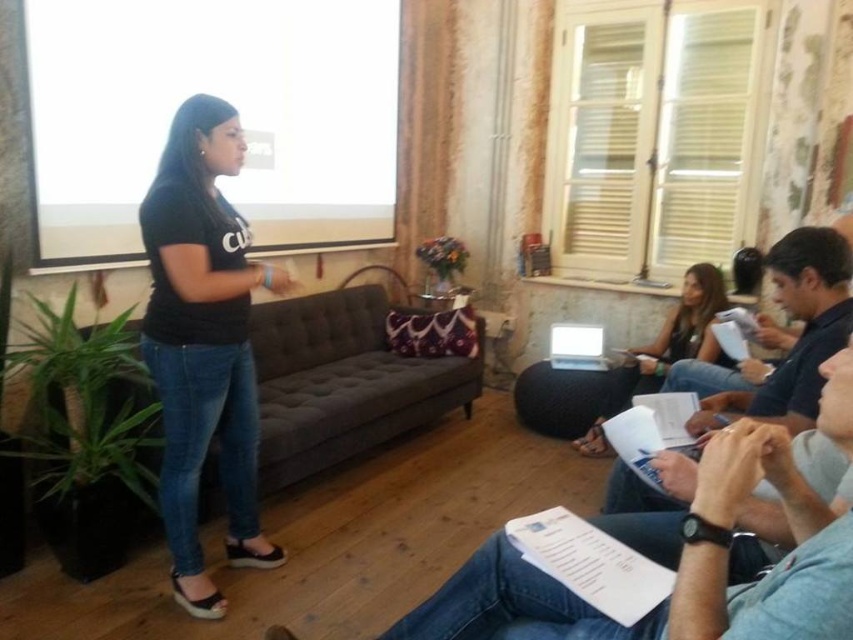
Question: Which is nearer to the black matte shirt at left?

Choices:
 (A) matte black laptop at center
 (B) white plastic laptop at center
 (C) dark blue shirt at lower right

Answer: (C)

Question: Is matte black laptop at center smaller than white plastic laptop at center?

Choices:
 (A) yes
 (B) no

Answer: (B)

Question: Can you confirm if black matte shirt at left is positioned below white plastic laptop at center?

Choices:
 (A) yes
 (B) no

Answer: (B)

Question: Which object is positioned farthest from the black matte shirt at left?

Choices:
 (A) matte black laptop at center
 (B) dark blue shirt at lower right
 (C) white plastic laptop at center

Answer: (C)

Question: Which point is closer to the camera?

Choices:
 (A) (695, 294)
 (B) (601, 364)

Answer: (A)

Question: Is the position of black matte shirt at left less distant than that of white plastic laptop at center?

Choices:
 (A) yes
 (B) no

Answer: (A)